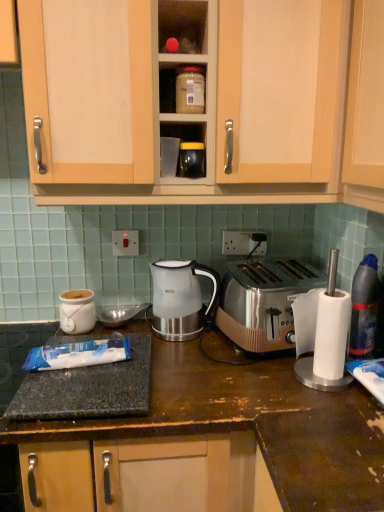
Where is `free space on the front side of satin silver kettle at center`? This screenshot has width=384, height=512. free space on the front side of satin silver kettle at center is located at coordinates (191, 354).